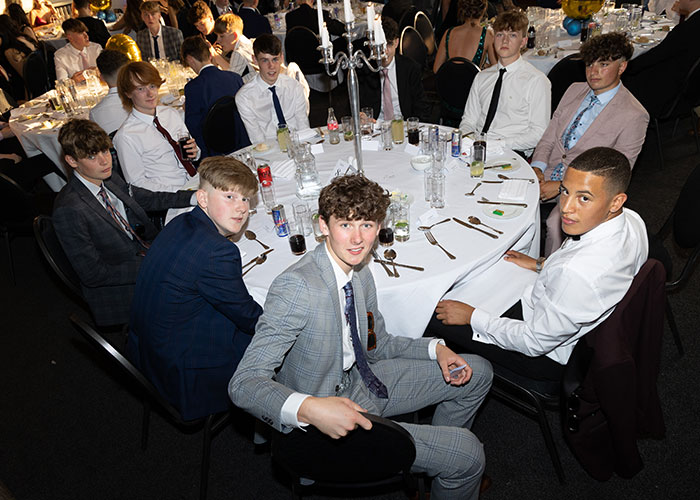
The height and width of the screenshot is (500, 700). I want to click on floor, so click(666, 474).